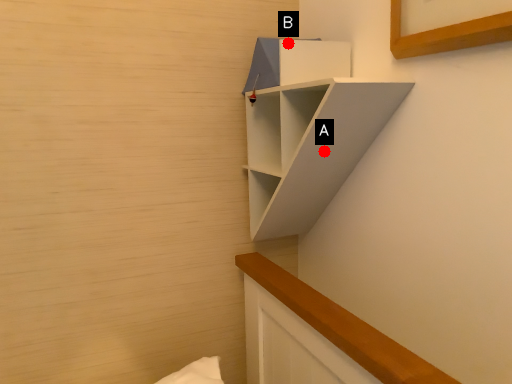
Question: Two points are circled on the image, labeled by A and B beside each circle. Which point is further to the camera?

Choices:
 (A) A is further
 (B) B is further

Answer: (B)